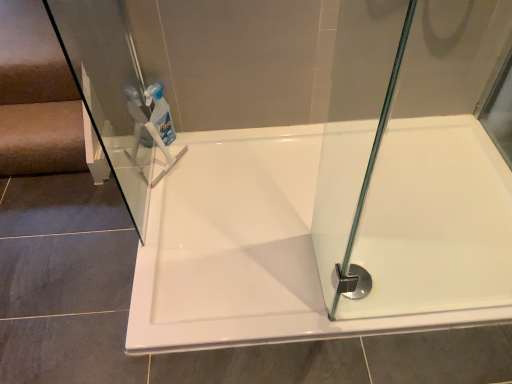
Question: From the image's perspective, would you say transparent plastic bottle at upper center is shown under white glossy bathtub at center?

Choices:
 (A) no
 (B) yes

Answer: (A)

Question: Can white glossy bathtub at center be found inside transparent plastic bottle at upper center?

Choices:
 (A) no
 (B) yes

Answer: (A)

Question: Does transparent plastic bottle at upper center appear on the right side of white glossy bathtub at center?

Choices:
 (A) yes
 (B) no

Answer: (B)

Question: Is transparent plastic bottle at upper center facing away from white glossy bathtub at center?

Choices:
 (A) no
 (B) yes

Answer: (A)

Question: Is transparent plastic bottle at upper center aimed at white glossy bathtub at center?

Choices:
 (A) no
 (B) yes

Answer: (B)

Question: Can you confirm if transparent plastic bottle at upper center is bigger than white glossy bathtub at center?

Choices:
 (A) yes
 (B) no

Answer: (B)

Question: Is polished chrome shower at bottom right turned away from white glossy bathtub at center?

Choices:
 (A) yes
 (B) no

Answer: (A)

Question: From the image's perspective, is polished chrome shower at bottom right on white glossy bathtub at center?

Choices:
 (A) yes
 (B) no

Answer: (B)

Question: From the image's perspective, is polished chrome shower at bottom right under white glossy bathtub at center?

Choices:
 (A) no
 (B) yes

Answer: (B)

Question: Would you say polished chrome shower at bottom right is a long distance from white glossy bathtub at center?

Choices:
 (A) yes
 (B) no

Answer: (B)

Question: Can you confirm if polished chrome shower at bottom right is positioned to the right of white glossy bathtub at center?

Choices:
 (A) no
 (B) yes

Answer: (A)

Question: Can you see polished chrome shower at bottom right touching white glossy bathtub at center?

Choices:
 (A) no
 (B) yes

Answer: (A)

Question: Can you see white glossy bathtub at center touching transparent plastic bottle at upper center?

Choices:
 (A) yes
 (B) no

Answer: (B)